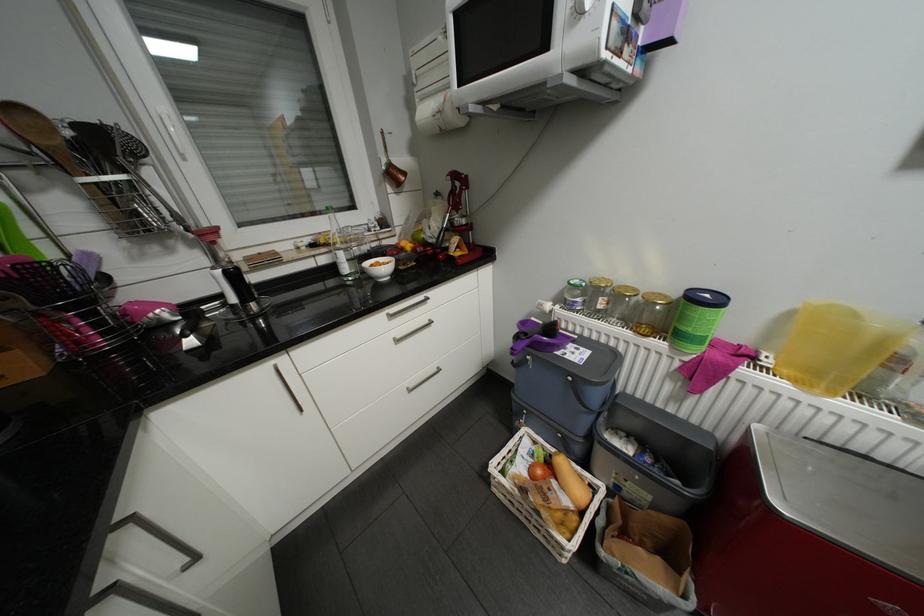
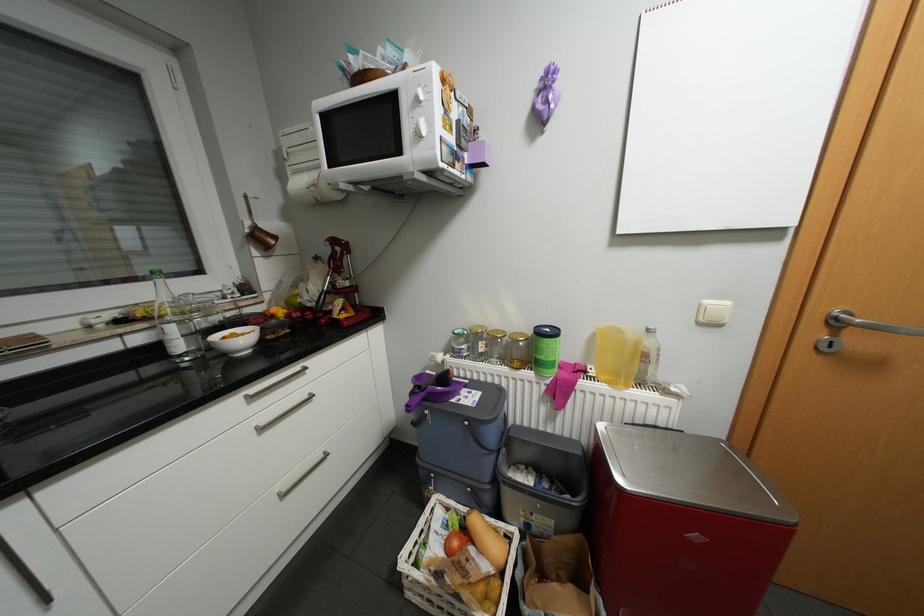
Find the pixel in the second image that matches point 609,297 in the first image.

(488, 342)